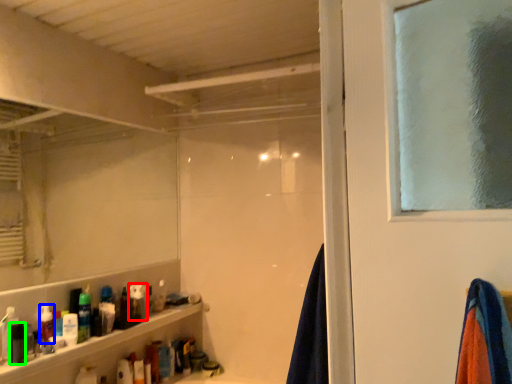
Question: Considering the real-world distances, which object is farthest from toiletry (highlighted by a red box)? toiletry (highlighted by a blue box) or toiletry (highlighted by a green box)?

Choices:
 (A) toiletry
 (B) toiletry

Answer: (B)